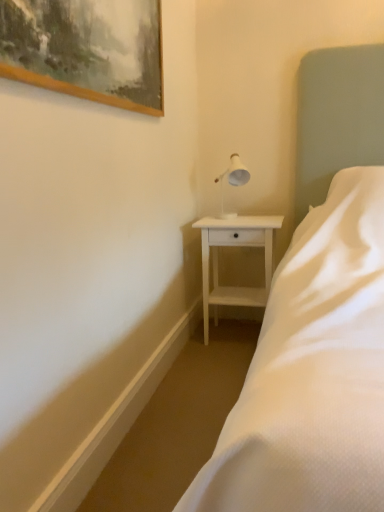
Question: From the image's perspective, relative to white wood nightstand at center, is white satin bed at center above or below?

Choices:
 (A) below
 (B) above

Answer: (B)

Question: In terms of width, does white satin bed at center look wider or thinner when compared to white wood nightstand at center?

Choices:
 (A) thin
 (B) wide

Answer: (B)

Question: Which is farther from the white glossy table lamp at upper right?

Choices:
 (A) white satin bed at center
 (B) wooden picture frame at upper left
 (C) white wood nightstand at center

Answer: (B)

Question: Estimate the real-world distances between objects in this image. Which object is farther from the white glossy table lamp at upper right?

Choices:
 (A) white wood nightstand at center
 (B) white satin bed at center
 (C) wooden picture frame at upper left

Answer: (C)